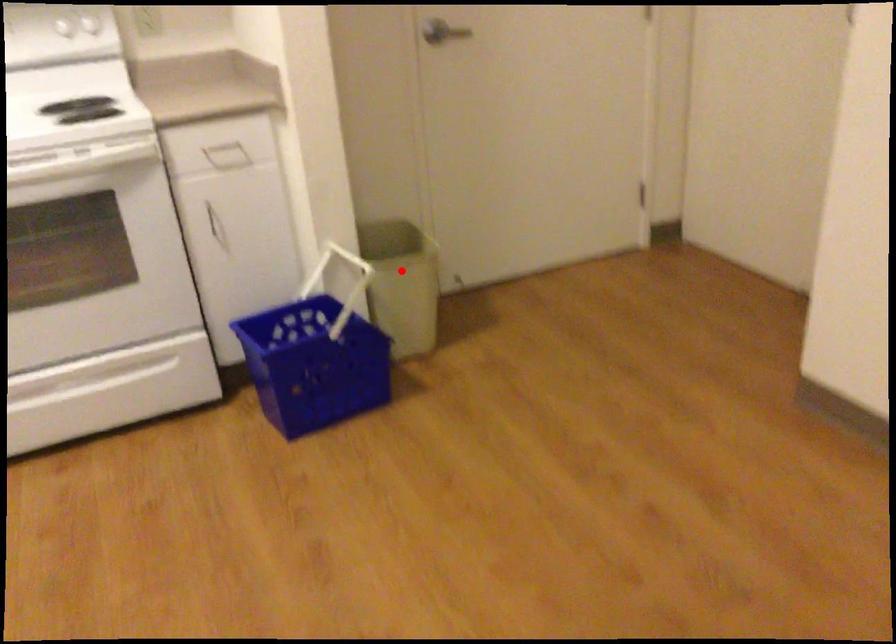
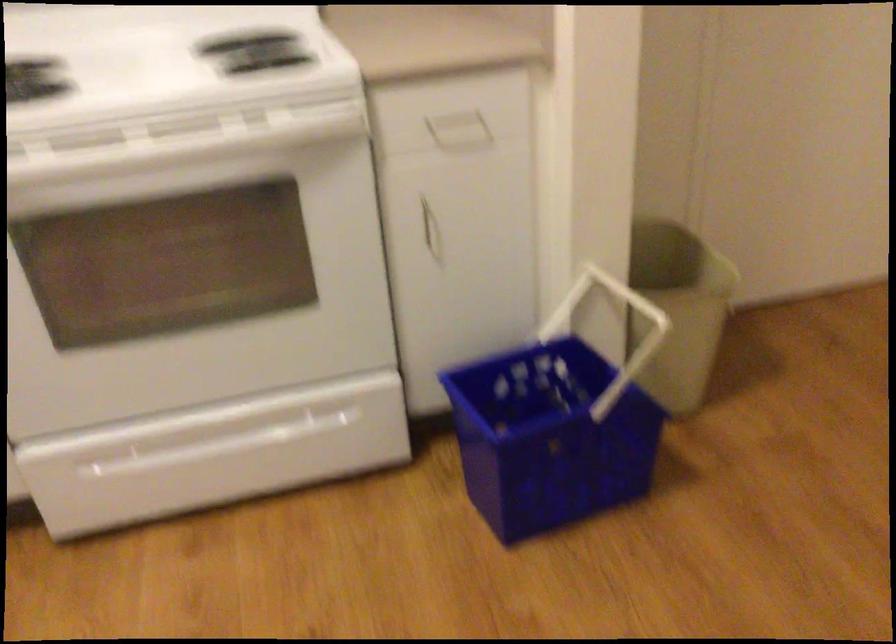
In the second image, find the point that corresponds to the highlighted location in the first image.

(678, 308)